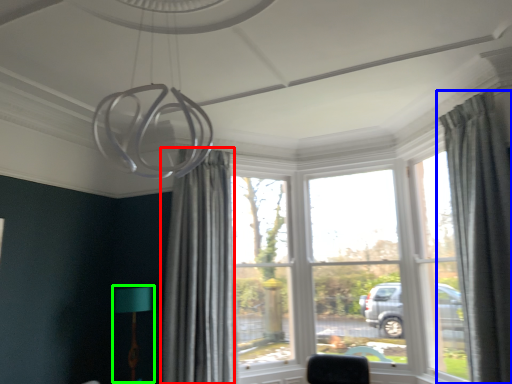
Question: Which is farther away from curtain (highlighted by a red box)? curtain (highlighted by a blue box) or table lamp (highlighted by a green box)?

Choices:
 (A) curtain
 (B) table lamp

Answer: (A)